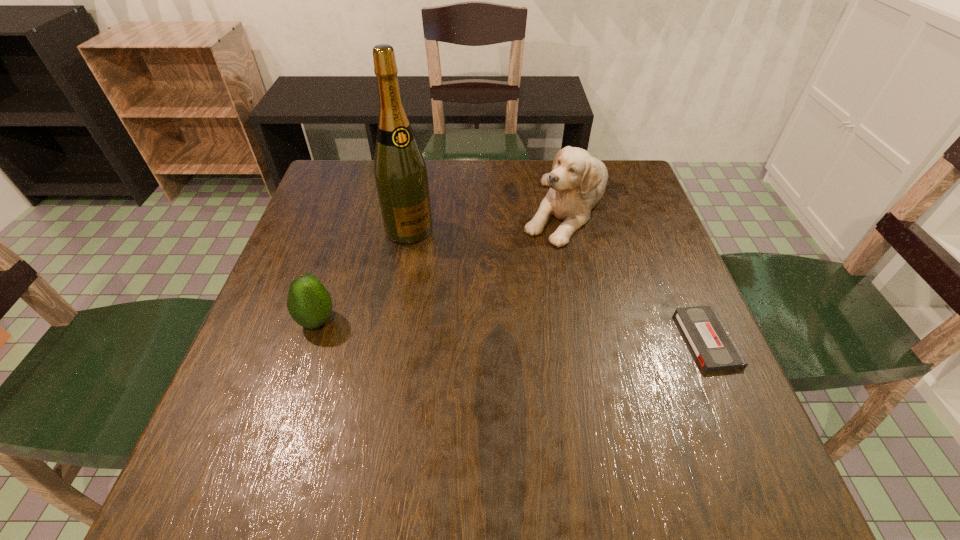
What are the coordinates of `free spot on the desktop that is between the leftmost object and the rightmost object and is positioned on the front-facing side of the third object from right to left` in the screenshot? It's located at (487, 329).

This screenshot has height=540, width=960. In order to click on vacant space on the desktop that is between the leftmost object and the shortest object and is positioned on the front-facing side of the puppy in this screenshot , I will do `click(517, 330)`.